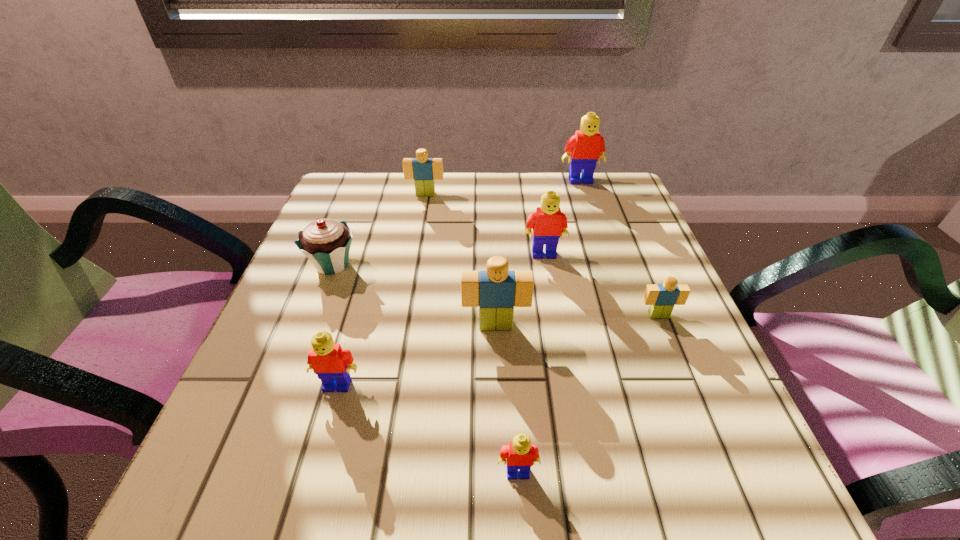
The width and height of the screenshot is (960, 540). I want to click on the farthest object, so click(x=587, y=146).

Locate an element on the screen. The width and height of the screenshot is (960, 540). the rightmost yellow Lego is located at coordinates (587, 146).

This screenshot has height=540, width=960. In order to click on the second beige Lego from left to right in this screenshot , I will do `click(496, 291)`.

Locate an element on the screen. the fifth nearest Lego is located at coordinates (548, 222).

At what (x,y) coordinates should I click in order to perform the action: click on the third Lego from right to left. Please return your answer as a coordinate pair (x, y). The height and width of the screenshot is (540, 960). Looking at the image, I should click on (548, 222).

This screenshot has width=960, height=540. Identify the location of the third object from left to right. (423, 170).

Identify the location of the sixth Lego from right to left. The height and width of the screenshot is (540, 960). (423, 170).

I want to click on the leftmost yellow Lego, so (332, 365).

The height and width of the screenshot is (540, 960). Identify the location of the sixth farthest Lego. (332, 365).

Find the location of a particular element. This screenshot has height=540, width=960. cupcake is located at coordinates (326, 243).